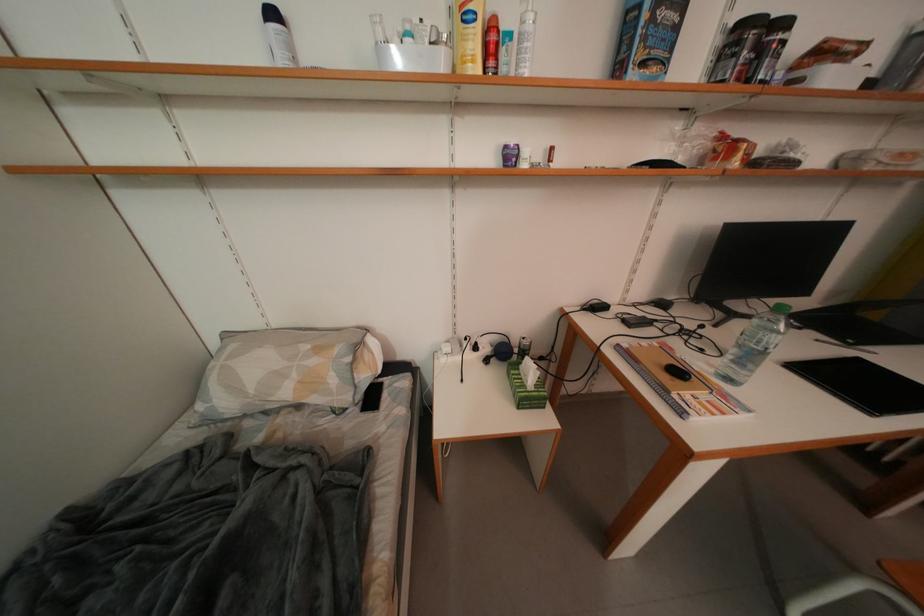
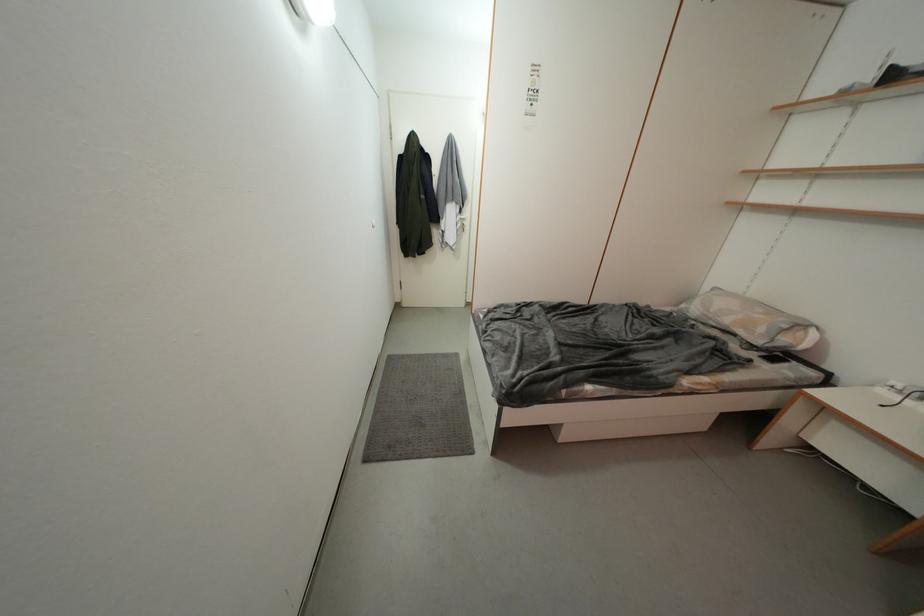
Locate, in the second image, the point that corresponds to (x=341, y=384) in the first image.

(769, 333)